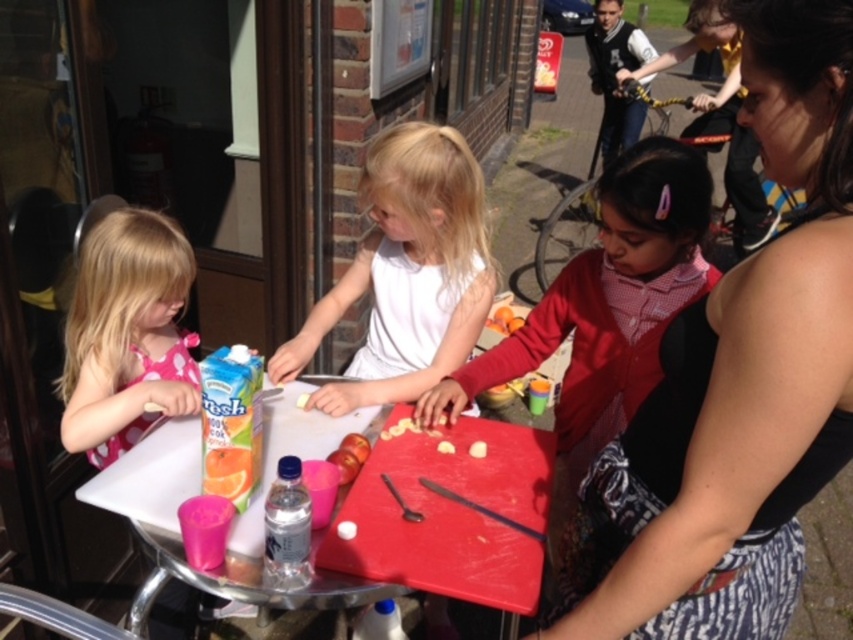
You are a photographer trying to capture a candid shot of the two children at the table. You want to ensure that both the white matte shirt at center and the pink fabric dress at left are clearly visible in the frame. Based on their sizes, which child should you position closer to the camera to ensure their clothing details are sharp and in focus?

The white matte shirt at center is wider than the pink fabric dress at left, so positioning the child in the white matte shirt at center closer to the camera will ensure their details are sharper and in focus.

You are a delivery person who needs to leave a package at the table. The package is 24 inches long. Can you place it between the matte black tank top at center and the matte red jacket at center without moving any items?

The distance between the matte black tank top at center and the matte red jacket at center is 20.64 inches. Since the package is 24 inches long, it cannot fit in the space between them. You will need to find another location to place the package.

You are a photographer standing in front of the table. You want to take a photo of the white matte shirt at center and the pink fabric dress at left. Which one will appear larger in the photo?

The white matte shirt at center will appear larger in the photo because it is closer to the viewer than the pink fabric dress at left.